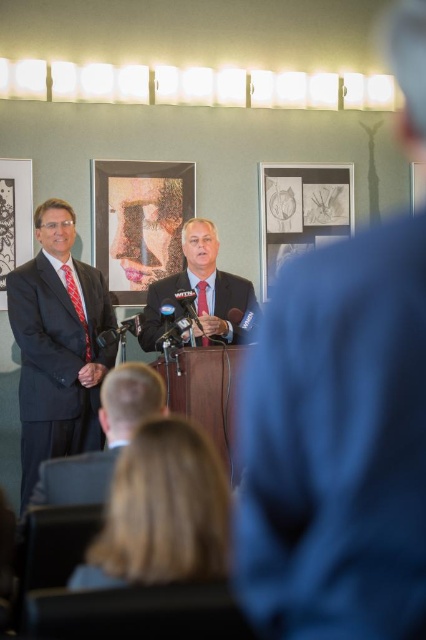
You are a photographer at the press conference. You need to take a photo of the black paper picture frame at center and the red silk tie at left. The camera you are using has a maximum focus range of 6 feet. Can you capture both objects in focus without moving the camera?

The black paper picture frame at center is 6.11 feet from the red silk tie at left. Since the distance between them exceeds the camera maximum focus range of 6 feet, you cannot capture both in focus without moving the camera.

You are attending a press conference and notice two elements in the scene. The first is the blonde hair at lower center and the second is the dark suit at center. Based on their sizes, which one do you think is closer to the front of the stage?

The blonde hair at lower center is larger in size than the dark suit at center, so it is closer to the front of the stage because objects closer to the viewer appear larger.

You are a photographer at the press conference. You need to capture a photo where both the black paper picture frame at center and the red silk tie at left are visible in the frame. Can you adjust your camera angle so that both objects are fully visible without cropping either of them?

The black paper picture frame at center might be wider than red silk tie at left, so you should position the camera to ensure both are within the frame by considering their widths. However, since the exact width comparison is uncertain, it is advisable to zoom out slightly to accommodate both objects comfortably.